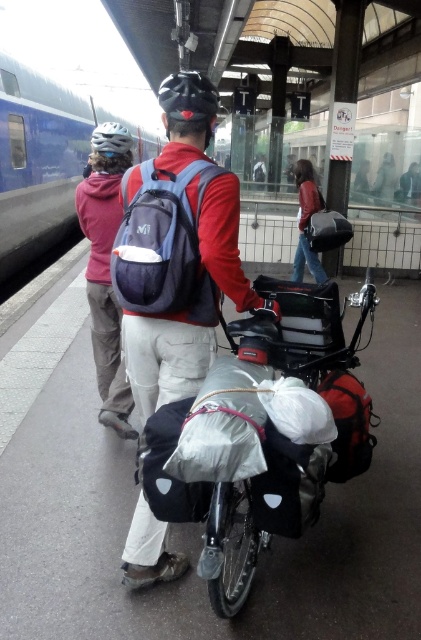
Between blue metallic train at left and matte pink hoodie at upper left, which one appears on the right side from the viewer's perspective?

Positioned to the right is matte pink hoodie at upper left.

Where is `blue metallic train at left`? This screenshot has height=640, width=421. blue metallic train at left is located at coordinates (45, 157).

In the scene shown: Which is more to the left, matte blue backpack at center or blue metallic train at left?

From the viewer's perspective, blue metallic train at left appears more on the left side.

Which is more to the right, matte blue backpack at center or blue metallic train at left?

From the viewer's perspective, matte blue backpack at center appears more on the right side.

Is point (213, 216) in front of point (58, 138)?

Yes, it is in front of point (58, 138).

Identify the location of matte blue backpack at center. (178, 252).

Who is more forward, (276,316) or (306,160)?

Positioned in front is point (276,316).

Between matte blue backpack at center and leather jacket at upper center, which one has more height?

Standing taller between the two is leather jacket at upper center.

This screenshot has height=640, width=421. I want to click on matte blue backpack at center, so click(x=178, y=252).